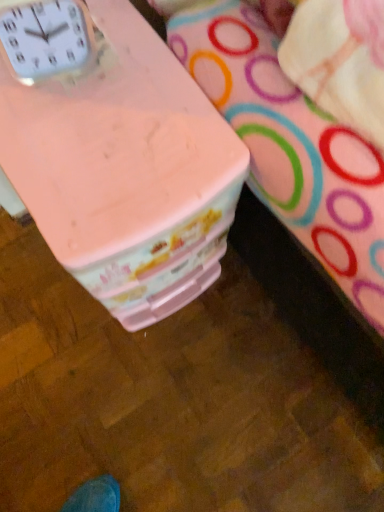
The width and height of the screenshot is (384, 512). In order to click on free spot in front of pink plastic container at center in this screenshot , I will do 135,378.